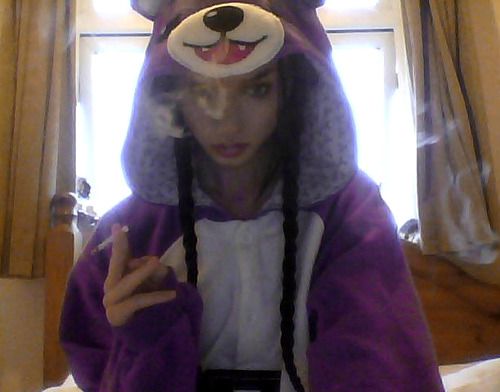
Where is `headboard`? headboard is located at coordinates (457, 316).